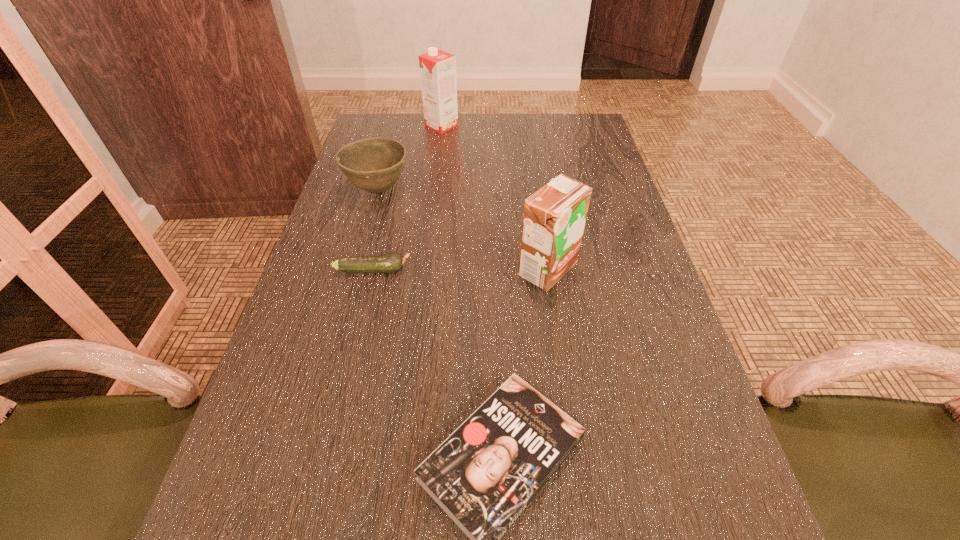
Find the location of a particular element. This screenshot has height=540, width=960. the left carton is located at coordinates (437, 68).

This screenshot has width=960, height=540. I want to click on the farthest object, so click(437, 68).

The width and height of the screenshot is (960, 540). I want to click on the nearer carton, so click(x=554, y=217).

At what (x,y) coordinates should I click in order to perform the action: click on the third tallest object. Please return your answer as a coordinate pair (x, y). The height and width of the screenshot is (540, 960). Looking at the image, I should click on (373, 164).

Locate an element on the screen. the fourth nearest object is located at coordinates (373, 164).

Find the location of a particular element. The height and width of the screenshot is (540, 960). the fourth tallest object is located at coordinates (392, 262).

The height and width of the screenshot is (540, 960). I want to click on vacant space located on the front of the farthest object, so click(435, 180).

This screenshot has width=960, height=540. Identify the location of vacant point located on the straw side of the nearer carton. (422, 270).

Image resolution: width=960 pixels, height=540 pixels. I want to click on vacant space situated 0.400m on the straw side of the nearer carton, so click(337, 270).

Locate an element on the screen. The image size is (960, 540). vacant space located on the straw side of the nearer carton is located at coordinates (342, 270).